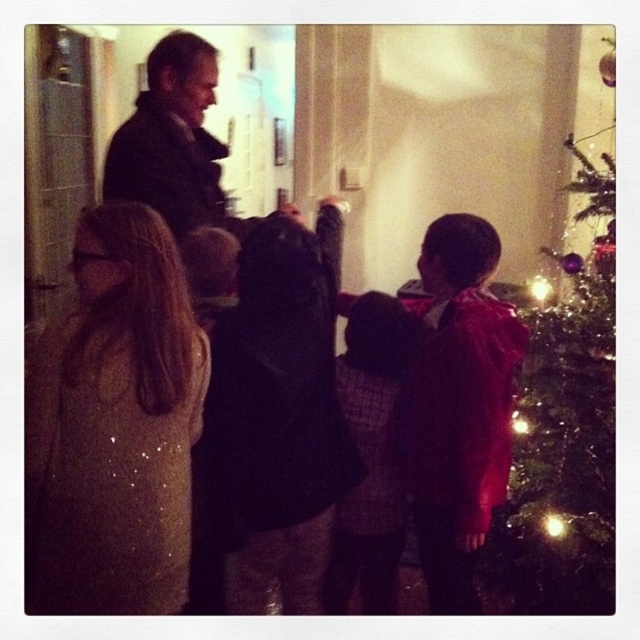
You are standing in the room where the shiny green tree at right and the dark wool coat at upper left are present. From your vantage point, which object is positioned higher up?

The dark wool coat at upper left is positioned higher up than the shiny green tree at right.

You are standing in the festive room and want to hand a gift to the person wearing the plaid fabric sweater at center without disturbing the person in the dark wool coat at upper left. Which direction should you approach from?

You should approach from the front of the plaid fabric sweater at center since it is closer to you than the dark wool coat at upper left, allowing you to reach them without needing to go around the other person.

You are organizing a photoshoot and need to place two props in the scene. The shiny sequined coat at center and the plaid fabric sweater at center must be arranged so that they are both visible in the frame. Given their sizes, which object should you place closer to the camera to ensure both are fully visible?

The shiny sequined coat at center is wider than the plaid fabric sweater at center. To ensure both are fully visible in the frame, place the plaid fabric sweater at center closer to the camera since it is narrower, allowing the wider shiny sequined coat at center to fit within the shot without being cropped.